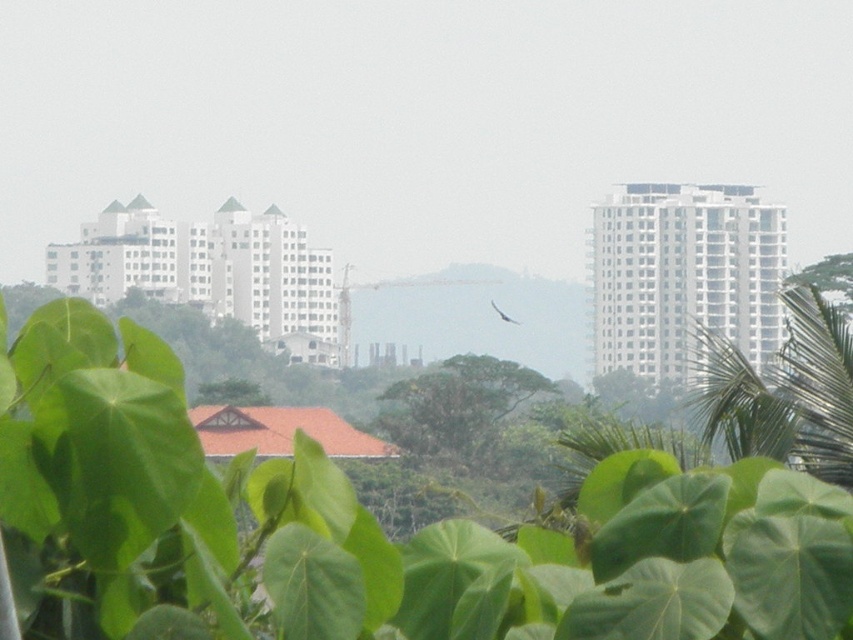
Question: Which point is closer to the camera?

Choices:
 (A) green leafy tree at center
 (B) white glossy bird at center
 (C) green leafy plant at center

Answer: (C)

Question: Observing the image, what is the correct spatial positioning of green leafy tree at center in reference to white glossy bird at center?

Choices:
 (A) left
 (B) right

Answer: (A)

Question: Estimate the real-world distances between objects in this image. Which object is farther from the green leafy plant at center?

Choices:
 (A) white glossy bird at center
 (B) green leafy tree at center

Answer: (A)

Question: Among these objects, which one is farthest from the camera?

Choices:
 (A) green leafy tree at center
 (B) white glossy bird at center

Answer: (B)

Question: Can you confirm if green leafy plant at center is positioned to the left of green leafy tree at center?

Choices:
 (A) yes
 (B) no

Answer: (B)

Question: Does green leafy plant at center appear over white glossy bird at center?

Choices:
 (A) yes
 (B) no

Answer: (A)